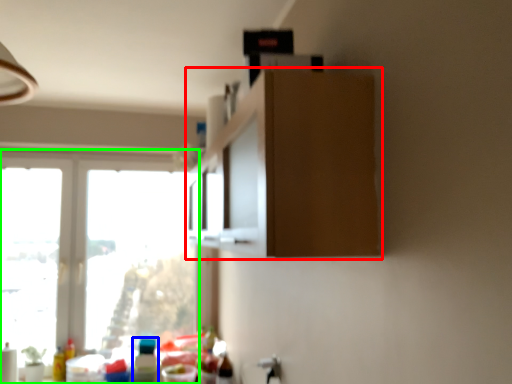
Question: Based on their relative distances, which object is farther from cabinetry (highlighted by a red box)? Choose from bottle (highlighted by a blue box) and window (highlighted by a green box).

Choices:
 (A) bottle
 (B) window

Answer: (B)